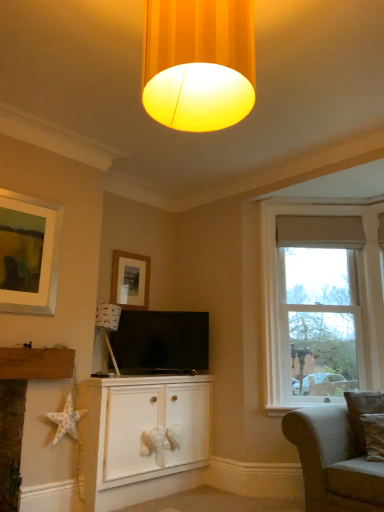
Question: Is white paper star at lower left inside the boundaries of matte yellow fabric lampshade at upper center, or outside?

Choices:
 (A) inside
 (B) outside

Answer: (B)

Question: From the image's perspective, is white paper star at lower left located above or below matte yellow fabric lampshade at upper center?

Choices:
 (A) below
 (B) above

Answer: (A)

Question: Which object is the closest to the clear glass window at right?

Choices:
 (A) matte yellow fabric lampshade at upper center
 (B) light gray fabric couch at lower right
 (C) matte black tv at center
 (D) white paper star at lower left
 (E) brown textured pillow at lower right

Answer: (B)

Question: Which is nearer to the clear glass window at right?

Choices:
 (A) white matte cabinet at center
 (B) matte yellow fabric lampshade at upper center
 (C) matte black tv at center
 (D) white textured star at lower left
 (E) brown textured pillow at lower right

Answer: (E)